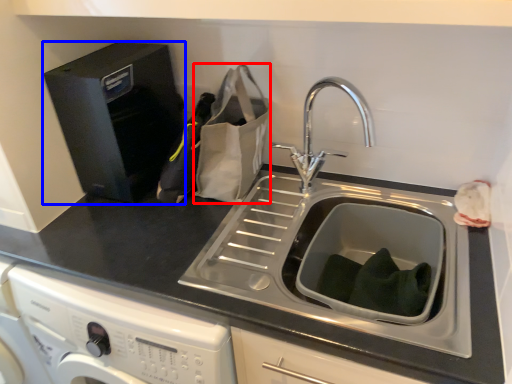
Question: Among these objects, which one is farthest to the camera, paper bag (highlighted by a red box) or appliance (highlighted by a blue box)?

Choices:
 (A) paper bag
 (B) appliance

Answer: (B)